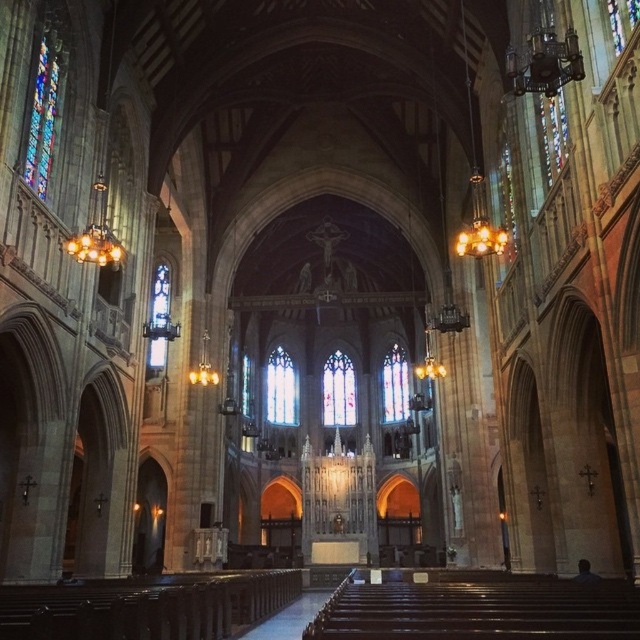
Question: Which of these objects is positioned farthest from the clear glass stained glass window at center?

Choices:
 (A) clear glass stained glass window at left
 (B) stained glass window at center
 (C) stained glass window at upper left
 (D) translucent stained glass at center

Answer: (C)

Question: Observing the image, what is the correct spatial positioning of translucent stained glass at center in reference to clear glass stained glass window at left?

Choices:
 (A) above
 (B) below

Answer: (B)

Question: Which point appears closest to the camera in this image?

Choices:
 (A) (243, 385)
 (B) (349, 419)
 (C) (390, 349)
 (D) (45, 122)

Answer: (D)

Question: In this image, where is translucent stained glass at center located relative to clear glass stained glass window at center?

Choices:
 (A) right
 (B) left

Answer: (A)

Question: Can you confirm if translucent stained glass at center is positioned to the right of clear glass stained glass window at center?

Choices:
 (A) no
 (B) yes

Answer: (B)

Question: Which object appears closest to the camera in this image?

Choices:
 (A) stained glass window at center
 (B) clear glass stained glass window at center
 (C) clear glass stained glass window at left

Answer: (C)